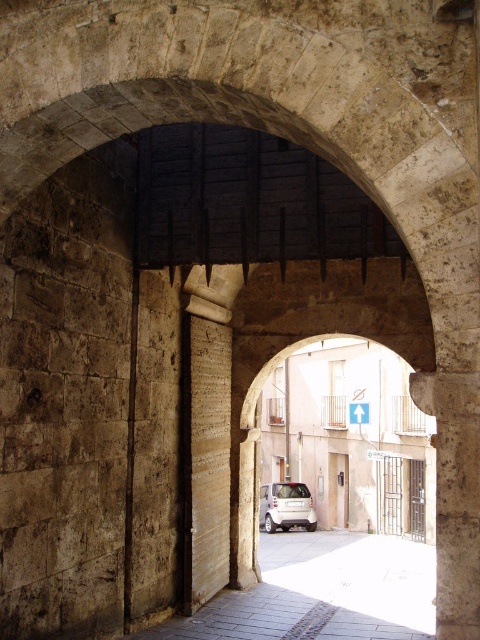
Is smooth stone alley at center positioned behind white matte car at center?

That is False.

Can you confirm if smooth stone alley at center is positioned above white matte car at center?

Indeed, smooth stone alley at center is positioned over white matte car at center.

Who is more forward, (x=311, y=596) or (x=308, y=528)?

Positioned in front is point (x=311, y=596).

Image resolution: width=480 pixels, height=640 pixels. I want to click on smooth stone alley at center, so click(x=322, y=593).